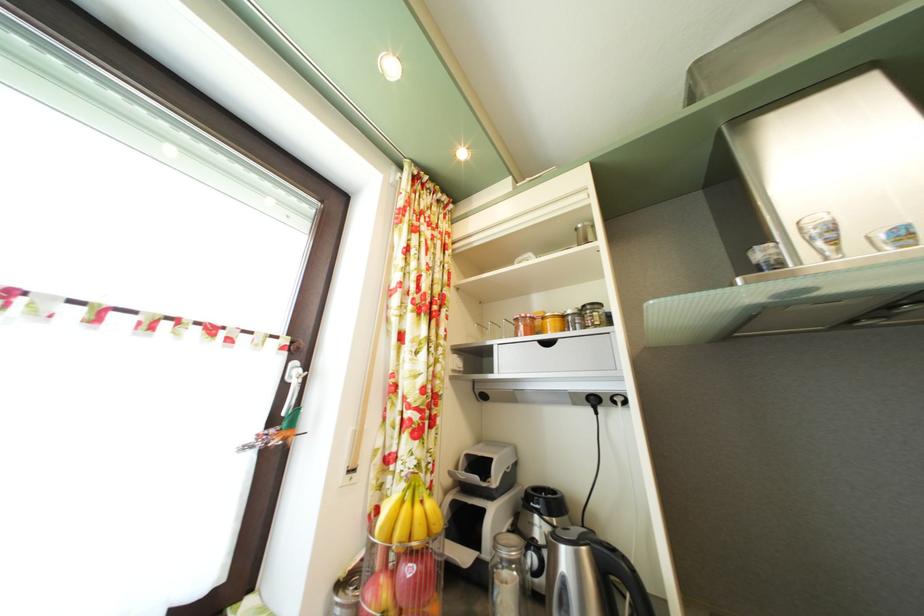
What do you see at coordinates (635, 600) in the screenshot? The width and height of the screenshot is (924, 616). I see `the electric kettle handle` at bounding box center [635, 600].